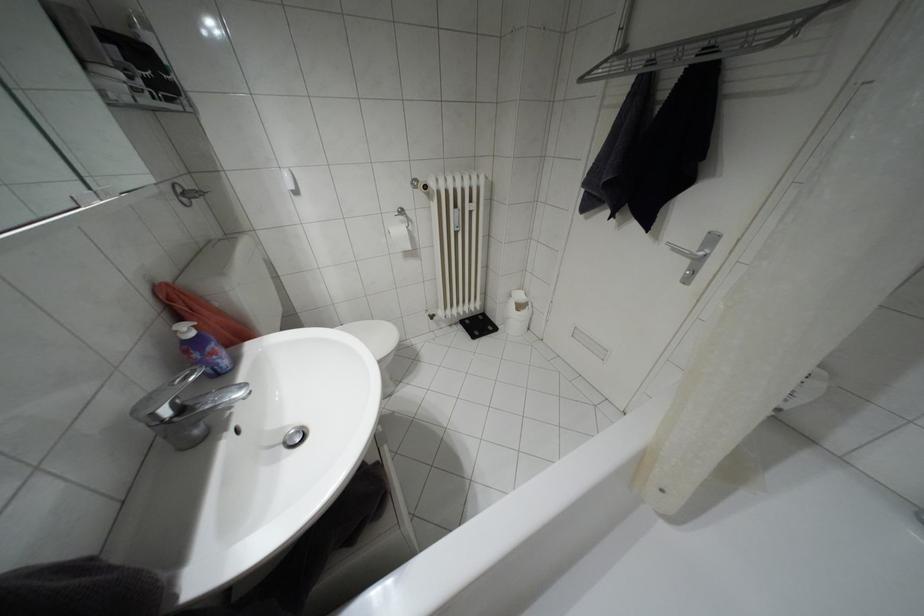
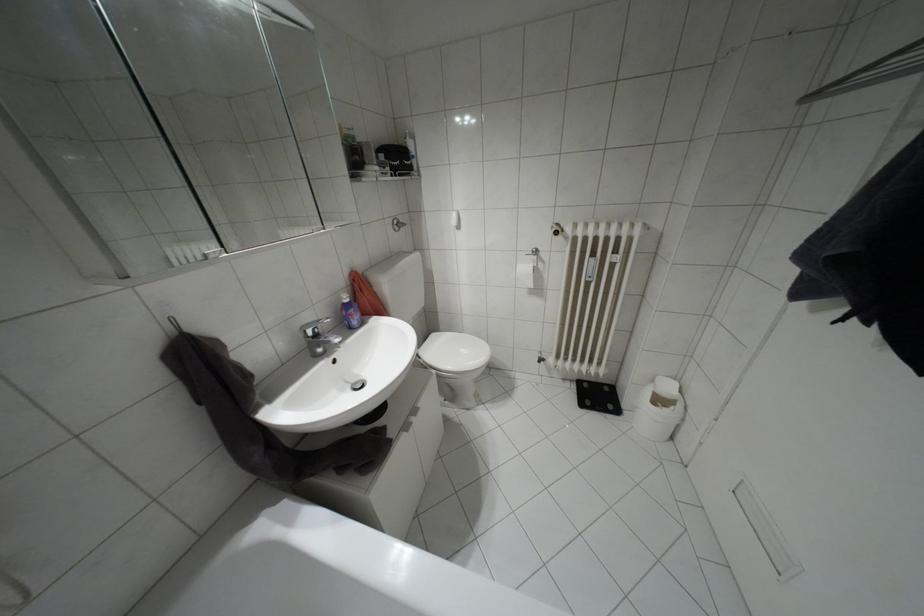
In the second image, find the point that corresponds to (x=508, y=296) in the first image.

(652, 379)